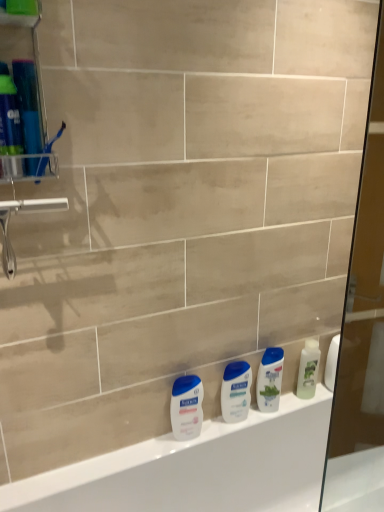
Question: Which direction should I rotate to face white glossy shampoo at center, which is the second cleaning product in right-to-left order, — up or down?

Choices:
 (A) up
 (B) down

Answer: (B)

Question: Is green matte lotion at right, the 2th cleaning product positioned from the left, to the right of white glossy shampoo at center, which is the second cleaning product in right-to-left order, from the viewer's perspective?

Choices:
 (A) no
 (B) yes

Answer: (B)

Question: Is the depth of green matte lotion at right, the 2th cleaning product positioned from the left, greater than that of white glossy shampoo at center, which is the second cleaning product in right-to-left order?

Choices:
 (A) yes
 (B) no

Answer: (A)

Question: Is green matte lotion at right, the 2th cleaning product positioned from the left, thinner than white glossy shampoo at center, acting as the 1th cleaning product starting from the left?

Choices:
 (A) no
 (B) yes

Answer: (B)

Question: Is green matte lotion at right, the 2th cleaning product positioned from the left, smaller than white glossy shampoo at center, which is the second cleaning product in right-to-left order?

Choices:
 (A) yes
 (B) no

Answer: (A)

Question: Is white glossy shampoo at center, which is the second cleaning product in right-to-left order, surrounded by green matte lotion at right, the 2th cleaning product positioned from the left?

Choices:
 (A) no
 (B) yes

Answer: (A)

Question: From the image's perspective, is green matte lotion at right, positioned as the 1th cleaning product in right-to-left order, below white glossy shampoo at center, which is the second cleaning product in right-to-left order?

Choices:
 (A) no
 (B) yes

Answer: (A)

Question: Is white glossy bathtub at lower center completely or partially outside of white glossy lotion at lower center, positioned as the 2th toiletry in right-to-left order?

Choices:
 (A) no
 (B) yes

Answer: (B)

Question: Is the depth of white glossy bathtub at lower center less than that of white glossy lotion at lower center, positioned as the 2th toiletry in right-to-left order?

Choices:
 (A) yes
 (B) no

Answer: (A)

Question: Is white glossy bathtub at lower center to the right of white glossy lotion at lower center, positioned as the 2th toiletry in right-to-left order, from the viewer's perspective?

Choices:
 (A) no
 (B) yes

Answer: (B)

Question: Considering the relative sizes of white glossy bathtub at lower center and white glossy lotion at lower center, which is counted as the 1th toiletry, starting from the left, in the image provided, is white glossy bathtub at lower center wider than white glossy lotion at lower center, which is counted as the 1th toiletry, starting from the left,?

Choices:
 (A) no
 (B) yes

Answer: (B)

Question: Does white glossy bathtub at lower center have a lesser height compared to white glossy lotion at lower center, which is counted as the 1th toiletry, starting from the left?

Choices:
 (A) yes
 (B) no

Answer: (B)

Question: Considering the relative sizes of white glossy bathtub at lower center and white glossy lotion at lower center, positioned as the 2th toiletry in right-to-left order, in the image provided, is white glossy bathtub at lower center taller than white glossy lotion at lower center, positioned as the 2th toiletry in right-to-left order,?

Choices:
 (A) yes
 (B) no

Answer: (A)

Question: Can you confirm if clear plastic toothbrush holder at left is positioned to the right of white glossy lotion at lower center, positioned as the 2th toiletry in right-to-left order?

Choices:
 (A) yes
 (B) no

Answer: (B)